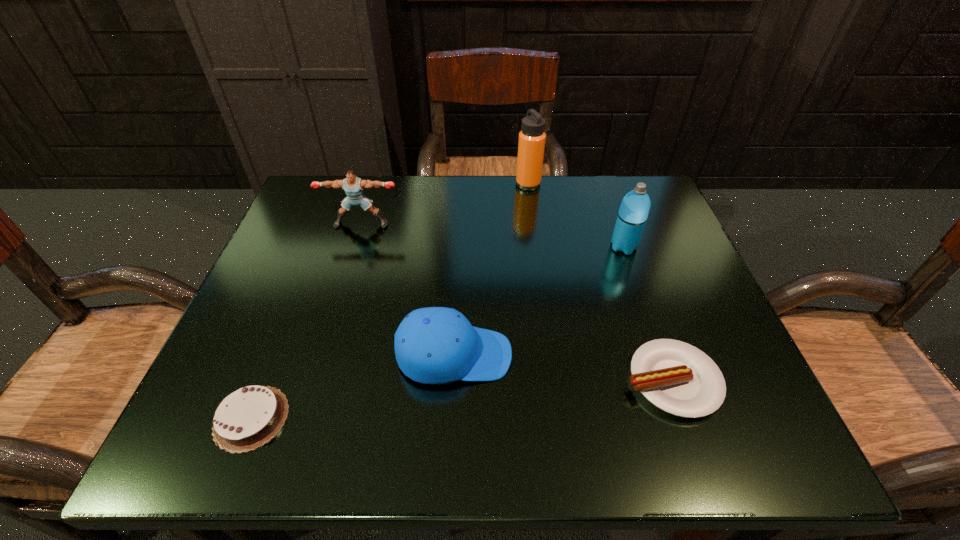
The width and height of the screenshot is (960, 540). In order to click on puncher positioned at the left edge in this screenshot , I will do `click(353, 186)`.

The width and height of the screenshot is (960, 540). What are the coordinates of `chocolate cake situated at the left edge` in the screenshot? It's located at (246, 419).

Find the location of `thermos bottle at the right edge`. thermos bottle at the right edge is located at coordinates (633, 213).

The width and height of the screenshot is (960, 540). I want to click on sausage that is at the right edge, so click(x=680, y=379).

Find the location of `object present at the far left corner`. object present at the far left corner is located at coordinates (353, 186).

At what (x,y) coordinates should I click in order to perform the action: click on object present at the near left corner. Please return your answer as a coordinate pair (x, y). This screenshot has width=960, height=540. Looking at the image, I should click on (246, 419).

At what (x,y) coordinates should I click in order to perform the action: click on object present at the near right corner. Please return your answer as a coordinate pair (x, y). This screenshot has width=960, height=540. Looking at the image, I should click on (680, 379).

The image size is (960, 540). In order to click on free region at the far edge of the desktop in this screenshot , I will do `click(566, 178)`.

You are a GUI agent. You are given a task and a screenshot of the screen. Output one action in this format:
    pyautogui.click(x=<x>, y=<y>)
    Task: Click on the vacant space at the near edge of the desktop
    
    Given the screenshot: What is the action you would take?
    pyautogui.click(x=352, y=442)

Identify the location of vacant area at the left edge. (240, 370).